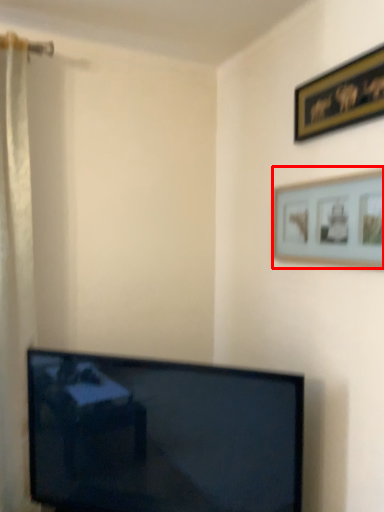
Question: From the image's perspective, what is the correct spatial positioning of picture frame (annotated by the red box) in reference to picture frame?

Choices:
 (A) above
 (B) below

Answer: (B)